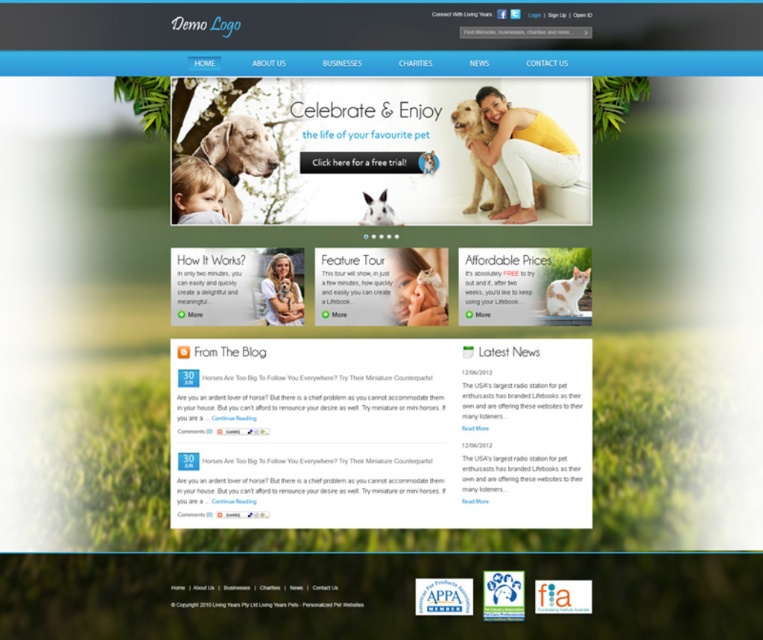
Who is taller, white fur dog at right or white glossy text at center?

white fur dog at right

The height and width of the screenshot is (640, 763). What do you see at coordinates (565, 292) in the screenshot?
I see `white fur dog at right` at bounding box center [565, 292].

Does point (575, 291) lie in front of point (307, 131)?

Yes.

Identify the location of white fur dog at right. This screenshot has width=763, height=640. (565, 292).

In the scene shown: Is matte gray dog at upper left below golden fur dog at center?

Correct, matte gray dog at upper left is located below golden fur dog at center.

Does matte gray dog at upper left appear on the left side of golden fur dog at center?

Indeed, matte gray dog at upper left is positioned on the left side of golden fur dog at center.

Who is more forward, (x=266, y=172) or (x=485, y=132)?

Point (x=266, y=172) is more forward.

Identify the location of matte gray dog at upper left. (237, 156).

Does point (491, 170) come behind point (549, 314)?

Yes, point (491, 170) is behind point (549, 314).

Between golden fur dog at center and white fur dog at right, which one appears on the right side from the viewer's perspective?

From the viewer's perspective, white fur dog at right appears more on the right side.

Does point (498, 188) come farther from viewer compared to point (555, 301)?

Yes.

The height and width of the screenshot is (640, 763). I want to click on golden fur dog at center, so click(472, 122).